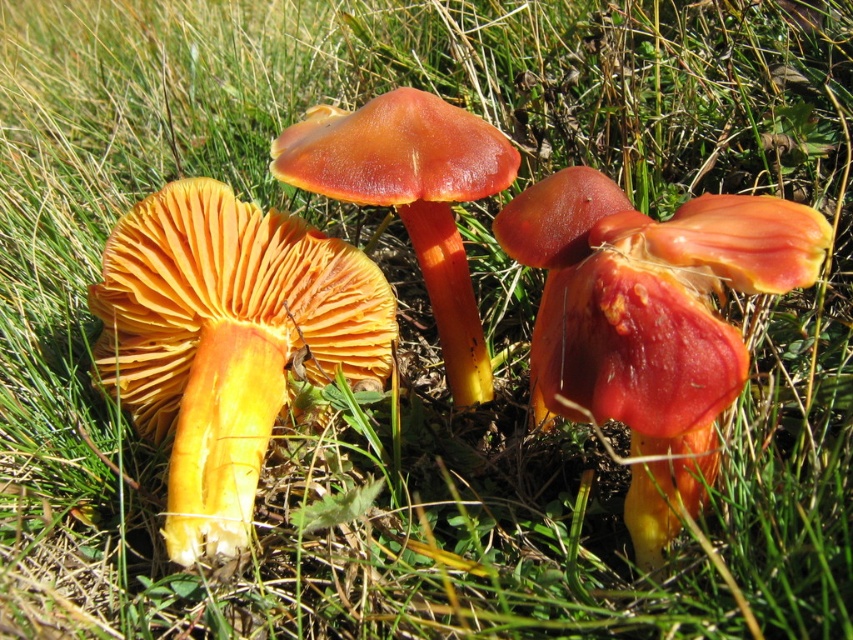
Question: Can you confirm if orange matte mushroom at left is positioned below glossy orange mushroom at center?

Choices:
 (A) yes
 (B) no

Answer: (A)

Question: Which object is closer to the camera taking this photo?

Choices:
 (A) glossy orange mushroom at center
 (B) shiny orange mushroom at center

Answer: (B)

Question: Is orange matte mushroom at left positioned behind shiny orange mushroom at center?

Choices:
 (A) no
 (B) yes

Answer: (B)

Question: Which point is closer to the camera taking this photo?

Choices:
 (A) (190, 388)
 (B) (351, 116)

Answer: (B)

Question: Which point is closer to the camera?

Choices:
 (A) orange matte mushroom at left
 (B) shiny orange mushroom at center
 (C) glossy orange mushroom at center

Answer: (B)

Question: Observing the image, what is the correct spatial positioning of orange matte mushroom at left in reference to shiny orange mushroom at center?

Choices:
 (A) below
 (B) above

Answer: (A)